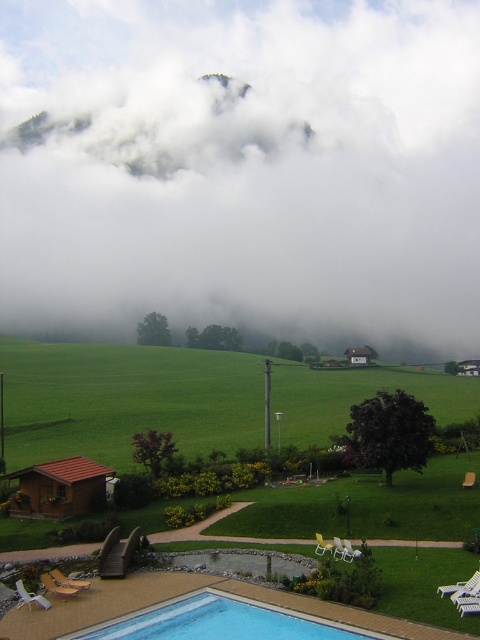
You are planning to install a drone delivery system that requires a clear path between the white fluffy cloud at upper center and the blue tile swimming pool at lower center. The minimum required distance for safe operation is 500 meters. Based on the scene, can the drone safely navigate this path?

The white fluffy cloud at upper center and blue tile swimming pool at lower center are 530.89 meters apart from each other, which exceeds the minimum required distance of 500 meters. Therefore, the drone can safely navigate the path between them.

You are standing at the point marked as point (361, 257) in the image. You want to walk to the swimming pool. Is the swimming pool located in front of you or behind you?

The swimming pool is located in front of you because the point (361, 257) is 526.08 meters away from the viewer, meaning the viewer is facing towards the pool area.

You are standing at the swimming pool and want to walk to the wooden cabin. There are two points marked on your map, point A at coordinates point (396, 298) and point B at coordinates point (203, 440). Which point is closer to you?

Point A at coordinates point (396, 298) is closer to you because it is further to the viewer than point B at coordinates point (203, 440).